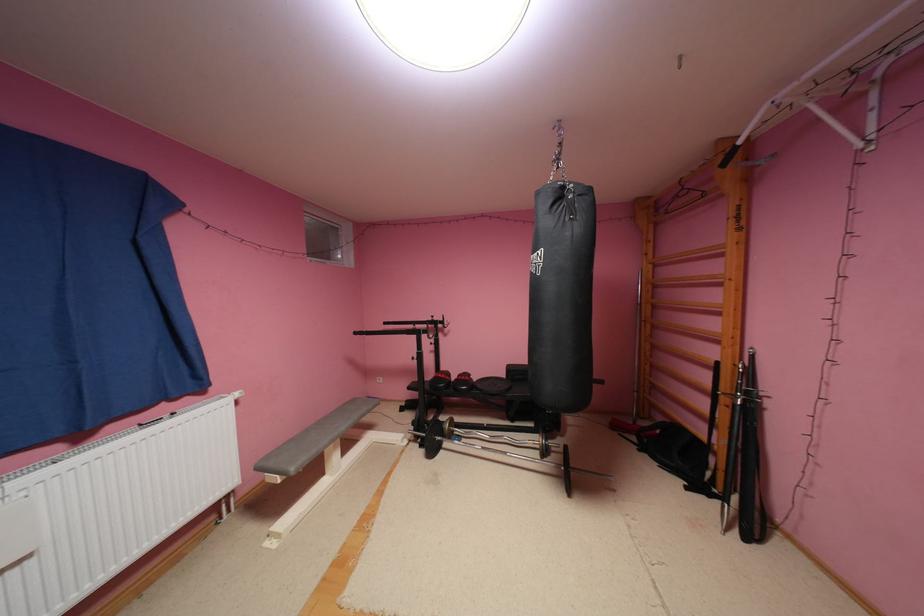
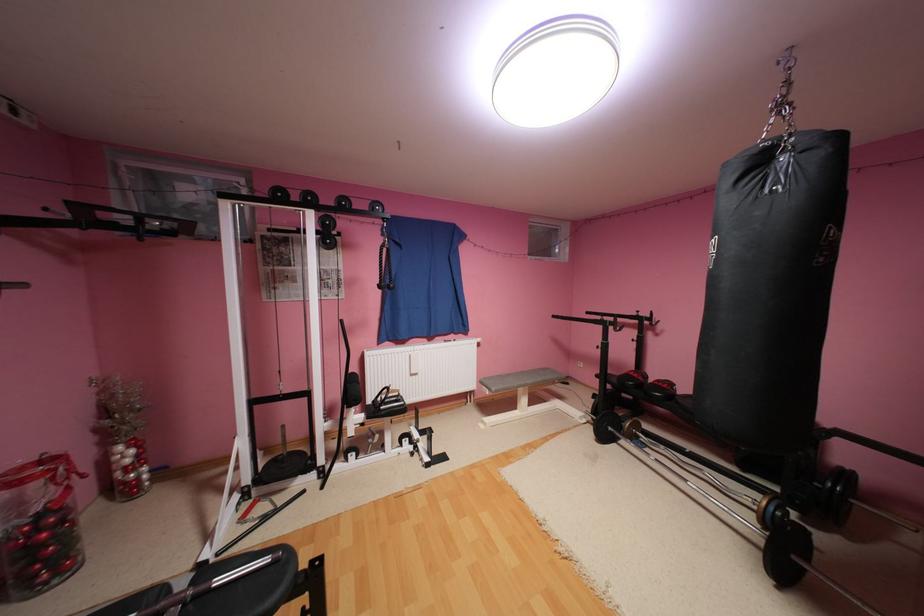
Locate, in the second image, the point that corresponds to (x=436, y=387) in the first image.

(624, 379)